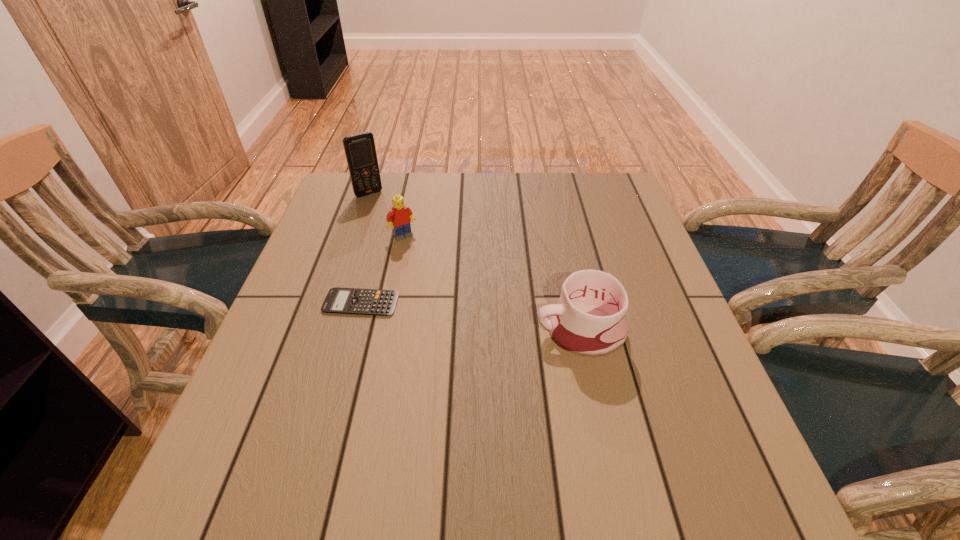
Image resolution: width=960 pixels, height=540 pixels. I want to click on vacant space located 0.200m on the front-facing side of the Lego, so click(444, 287).

Locate an element on the screen. Image resolution: width=960 pixels, height=540 pixels. vacant space positioned 0.370m on the front-facing side of the Lego is located at coordinates (480, 335).

Identify the location of vacant space located on the screen of the farthest object. This screenshot has width=960, height=540. (399, 231).

Locate an element on the screen. vacant space located on the screen of the farthest object is located at coordinates (401, 233).

Where is `free spot located on the screen of the farthest object`? The image size is (960, 540). free spot located on the screen of the farthest object is located at coordinates (417, 254).

Locate an element on the screen. The height and width of the screenshot is (540, 960). object located in the far edge section of the desktop is located at coordinates (360, 151).

Locate an element on the screen. This screenshot has width=960, height=540. calculator situated at the left edge is located at coordinates (357, 301).

I want to click on cellular telephone that is at the left edge, so click(360, 151).

You are a GUI agent. You are given a task and a screenshot of the screen. Output one action in this format:
    pyautogui.click(x=<x>, y=<y>)
    Task: Click on the object that is positioned at the right edge
    This screenshot has height=540, width=960.
    Given the screenshot: What is the action you would take?
    pyautogui.click(x=589, y=320)

Find the location of a particular element. Image resolution: width=960 pixels, height=540 pixels. object that is at the far left corner is located at coordinates (360, 151).